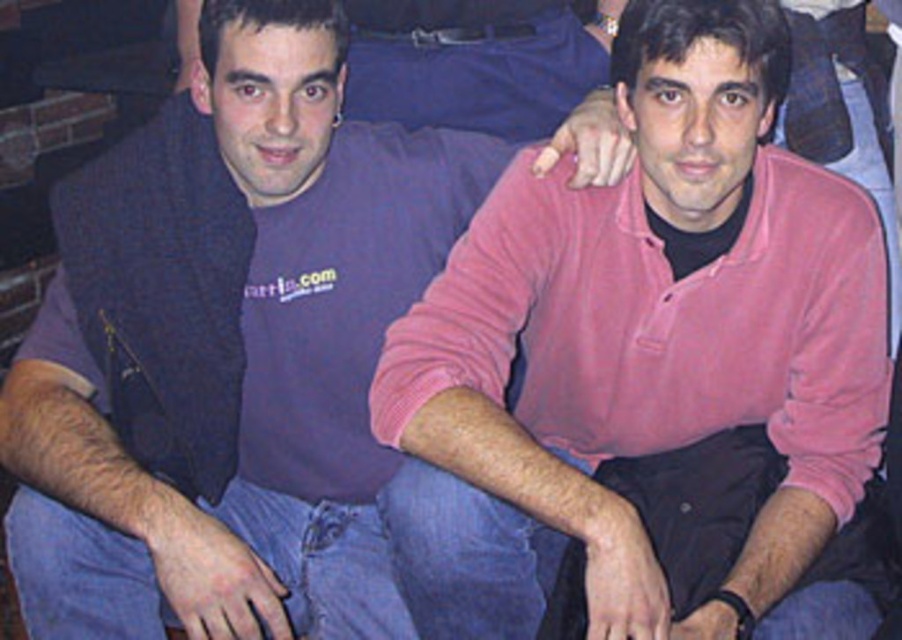
Question: Does pink cotton shirt at center have a greater width compared to pink cotton sweater at center?

Choices:
 (A) no
 (B) yes

Answer: (B)

Question: Which object is closer to the camera taking this photo?

Choices:
 (A) pink cotton sweater at center
 (B) purple soft sweater at center
 (C) pink cotton shirt at center

Answer: (C)

Question: Among these objects, which one is farthest from the camera?

Choices:
 (A) pink cotton shirt at center
 (B) purple soft sweater at center
 (C) pink cotton sweater at center

Answer: (B)

Question: Does pink cotton sweater at center appear under purple soft sweater at center?

Choices:
 (A) yes
 (B) no

Answer: (A)

Question: Considering the real-world distances, which object is closest to the pink cotton shirt at center?

Choices:
 (A) purple soft sweater at center
 (B) pink cotton sweater at center

Answer: (B)

Question: Is pink cotton shirt at center to the left of purple soft sweater at center from the viewer's perspective?

Choices:
 (A) no
 (B) yes

Answer: (A)